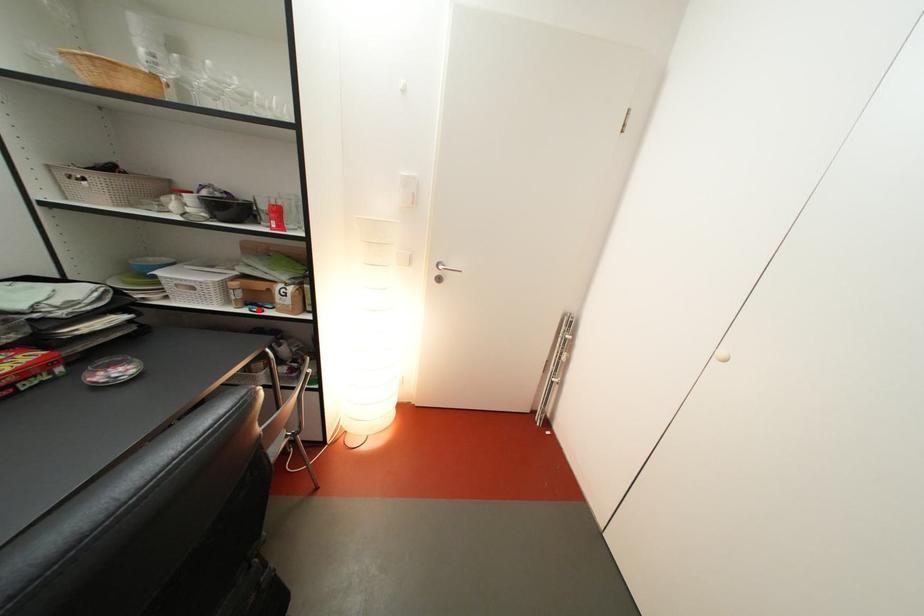
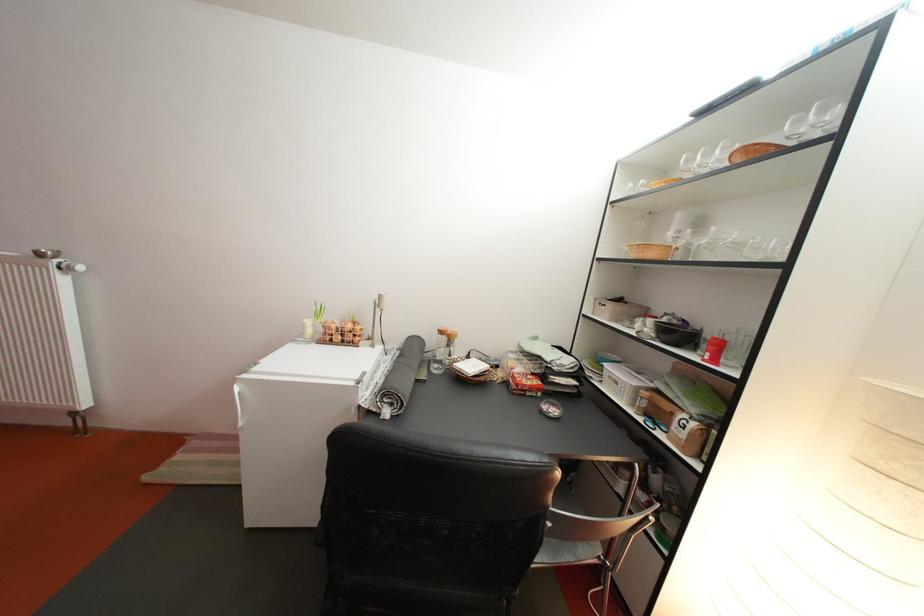
Find the pixel in the second image that matches the highlighted location in the first image.

(658, 421)